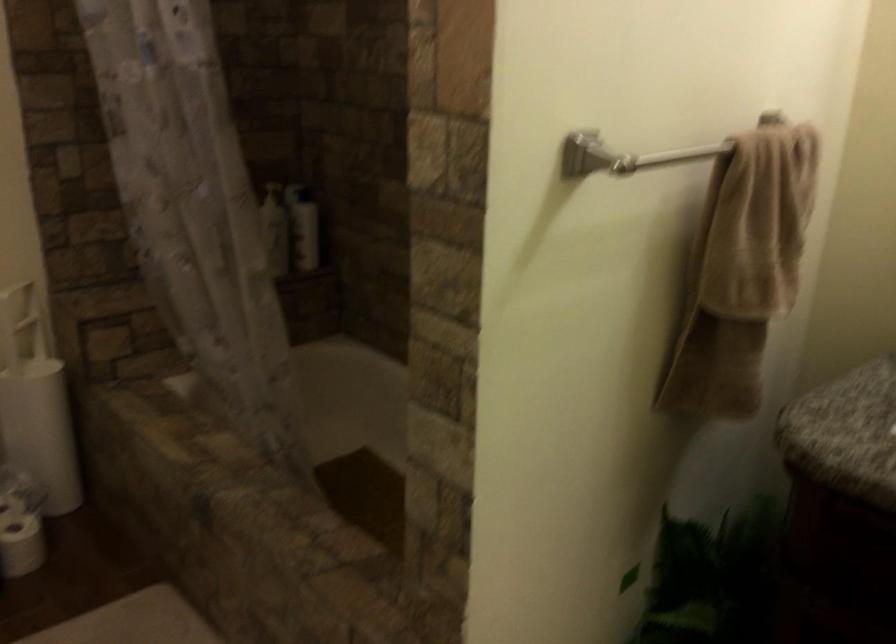
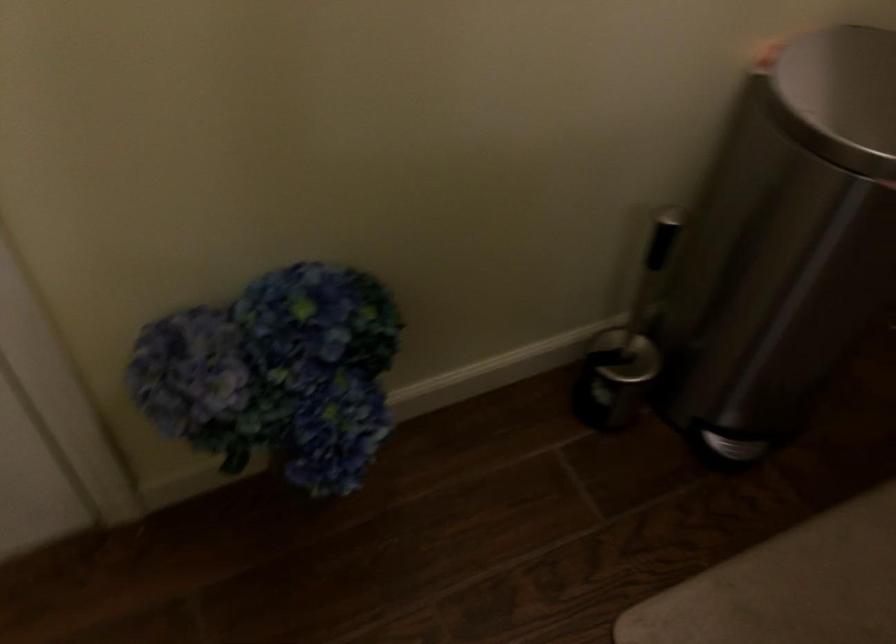
The images are taken continuously from a first-person perspective. In which direction is your viewpoint rotating?

The camera's rotation is toward left-down.